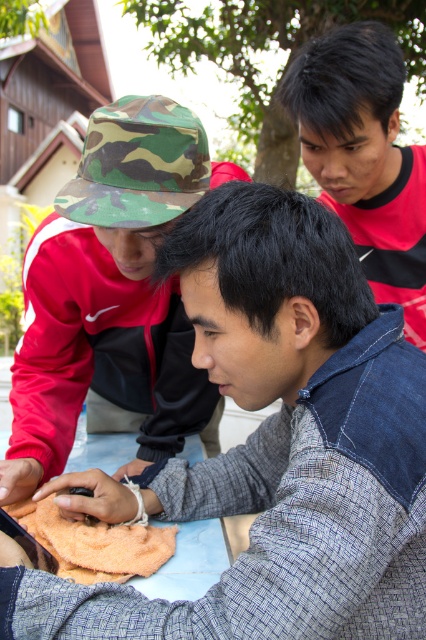
You are a photographer trying to capture a photo of the red shirt at upper right and the orange terry cloth at lower left. Which object should you focus on first if you want to ensure both are in focus without adjusting the camera settings?

The red shirt at upper right is above the orange terry cloth at lower left, so focusing on the red shirt at upper right first would help ensure both are in focus since it is closer to the camera.

What is the relationship between the camouflage fabric hat at upper left and the camo hat at upper left in terms of their positions?

The camouflage fabric hat at upper left is in front of the camo hat at upper left.